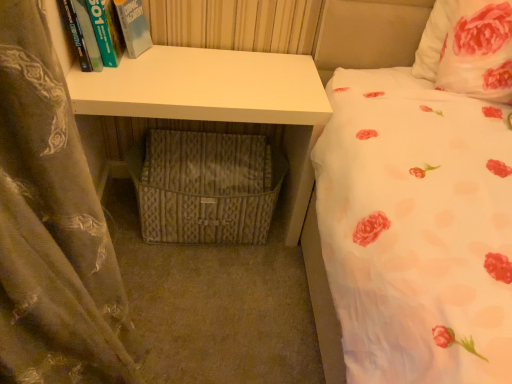
Where is `free space above white matte desk at center (from a real-world perspective)`? The width and height of the screenshot is (512, 384). free space above white matte desk at center (from a real-world perspective) is located at coordinates (213, 78).